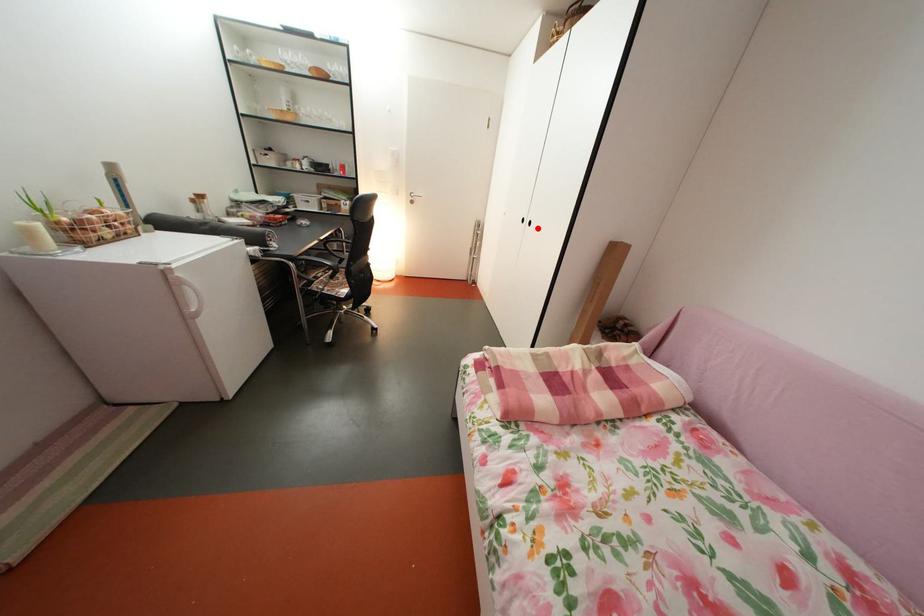
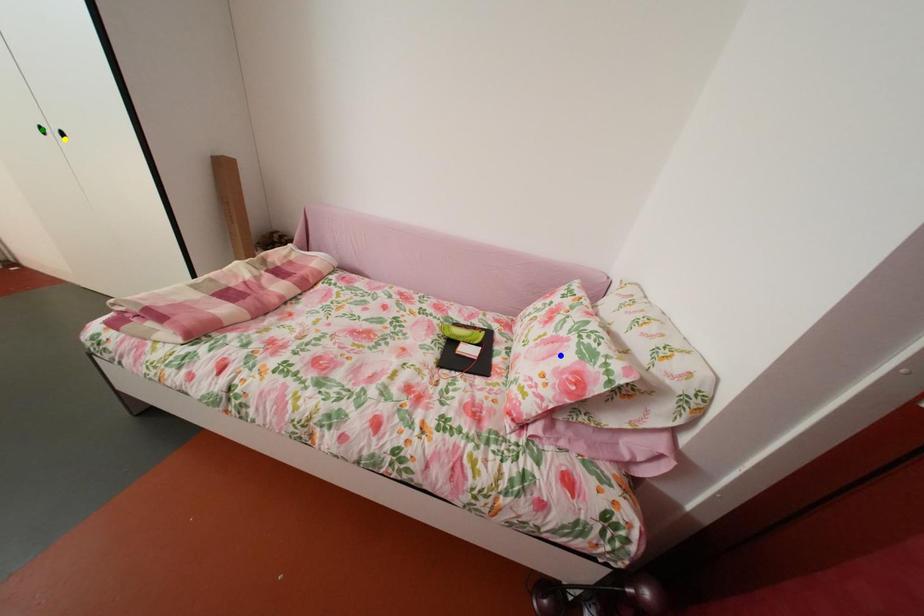
Question: I am providing you with two images of the same scene from different viewpoints. A red point is marked on the first image. You are given multiple points on the second image. Which mark in image 2 goes with the point in image 1?

Choices:
 (A) green point
 (B) yellow point
 (C) blue point

Answer: (B)